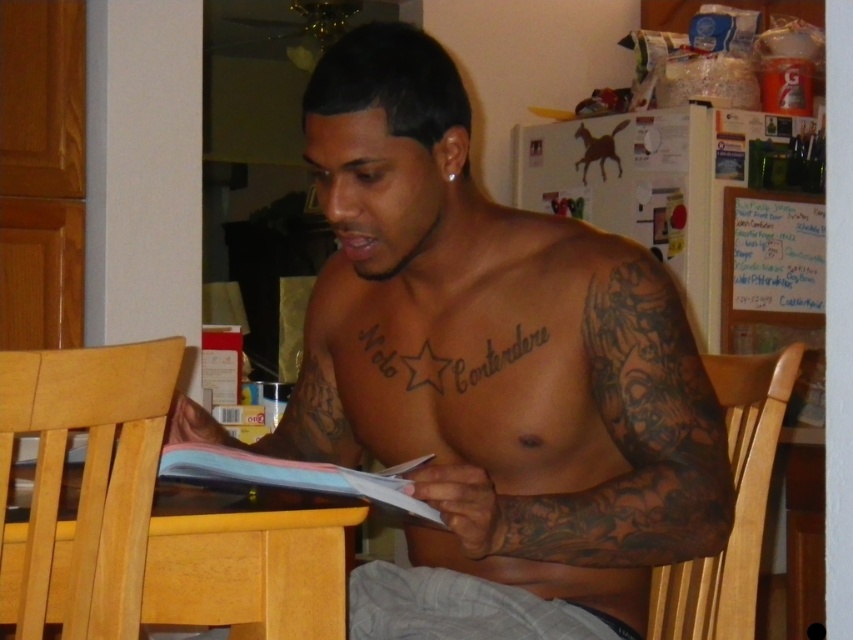
You are a person who is 1.7 meters tall. You want to sit on the light wood chair at lower right while placing your coffee mug on the light brown wood dining table at lower center. Will your mug stay stable on the table without falling off?

The light brown wood dining table at lower center is not as tall as the light wood chair at lower right, so the table is shorter. Since the table is shorter, the mug placed on it will be at a lower height, but stability depends on the table surface. The description does not mention the table being unstable, so the mug should stay stable unless the surface is uneven.

You are a guest entering the kitchen and want to sit down at the light brown wood dining table at lower center. Which side of the light wood chair at lower right should you approach to face the table?

You should approach the left side of the light wood chair at lower right because the light brown wood dining table at lower center is positioned on the left side of the light wood chair at lower right, so facing the table would require sitting on the left side of the chair.

You are a forensic analyst examining the image of a man in a kitchen. You need to determine the visibility of the tattoos. Which tattoo, the dark skin tattooed torso at center or the black ink tattoo at chest, is more prominently visible in the scene?

The dark skin tattooed torso at center is much taller than the black ink tattoo at chest, making it more prominently visible in the scene.